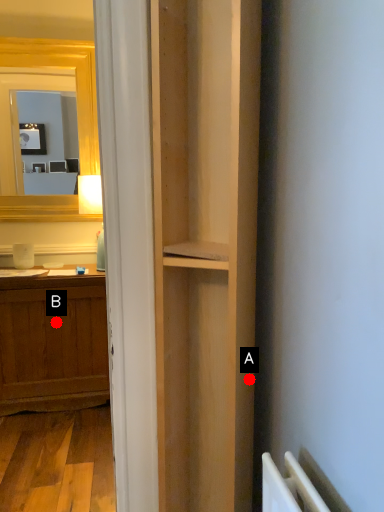
Question: Two points are circled on the image, labeled by A and B beside each circle. Among these points, which one is nearest to the camera?

Choices:
 (A) A is closer
 (B) B is closer

Answer: (A)